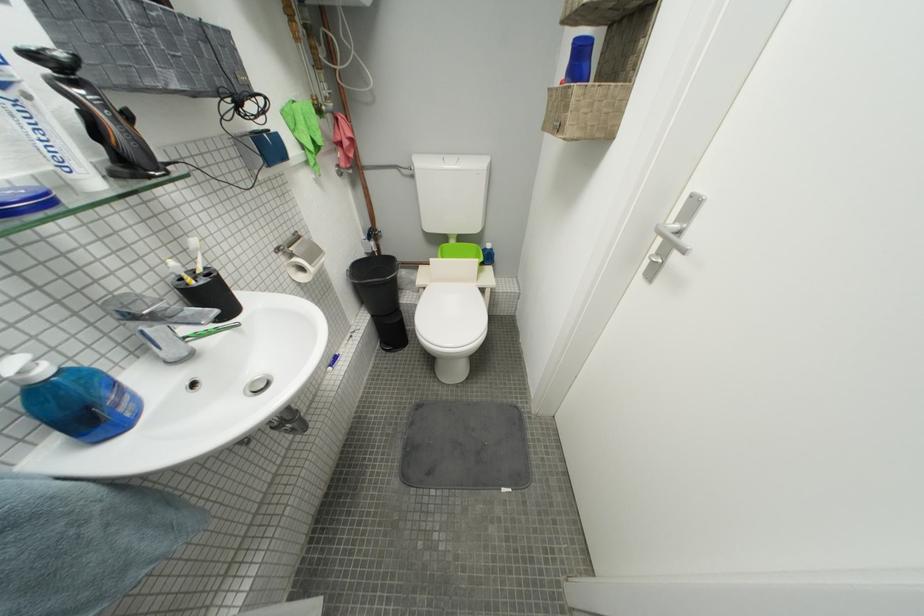
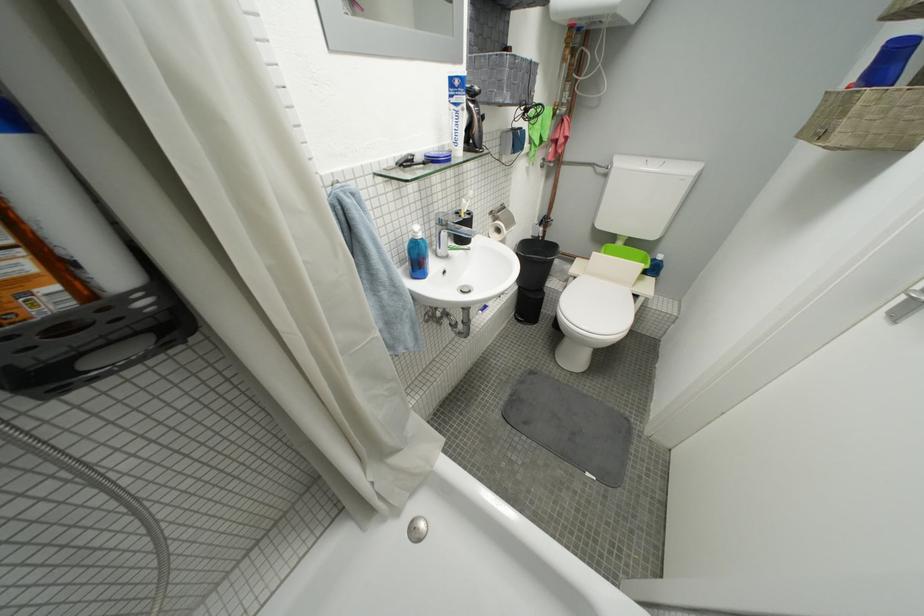
Where in the second image is the point corresponding to pixel 433 291 from the first image?

(584, 281)